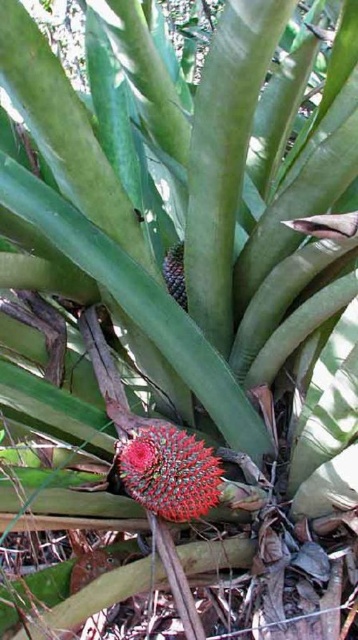
You are a botanist examining the bromeliad plant. The shiny red spiky fruit at center is crucial for your study. Can you confirm its exact position relative to the center of the image?

The shiny red spiky fruit at center is located at point coordinates of (168,472), which means it is slightly to the right and below the exact center of the image.

You are a botanist examining the bromeliad plant. You notice two features at the center of the plant. Which one is closer to you, the shiny red spiky fruit at center or the satin purple pineapple at center?

The shiny red spiky fruit at center is closer to the viewer than the satin purple pineapple at center.

You are a botanist examining a bromeliad plant. You notice two central features at the center of the plant. One is the shiny red spiky fruit at center, and the other is the satin purple pineapple at center. Which one has a greater height?

The satin purple pineapple at center is taller than the shiny red spiky fruit at center, so the satin purple pineapple at center has a greater height.